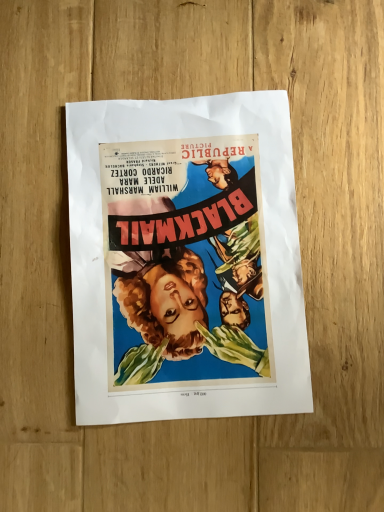
Question: Should I look upward or downward to see matte paper poster at center?

Choices:
 (A) up
 (B) down

Answer: (A)